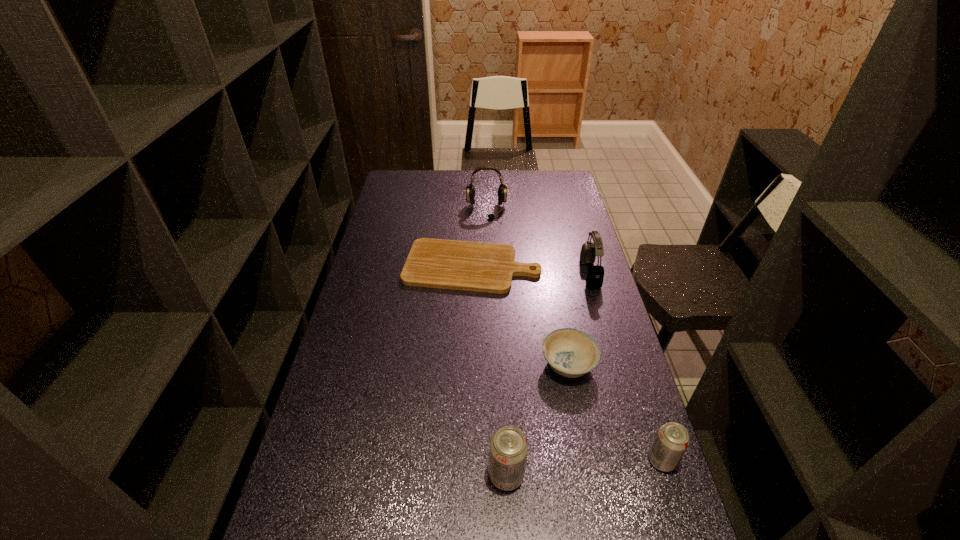
Identify the location of vacant space located on the back of the fourth tallest object. The width and height of the screenshot is (960, 540). (641, 397).

This screenshot has height=540, width=960. I want to click on blank area located 0.360m on the back of the shortest object, so click(x=473, y=197).

Locate an element on the screen. free space located 0.200m with the microphone on the side of the farther headset is located at coordinates (488, 247).

The height and width of the screenshot is (540, 960). I want to click on free location located on the headband of the right headset, so click(553, 274).

This screenshot has height=540, width=960. I want to click on vacant space located 0.370m on the headband of the right headset, so click(484, 274).

The image size is (960, 540). Identify the location of blank space located 0.170m on the headband of the right headset. (537, 274).

Find the location of a particular element. This screenshot has height=540, width=960. vacant space situated on the back of the fourth farthest object is located at coordinates (551, 273).

This screenshot has width=960, height=540. Find the location of `object that is at the left edge`. object that is at the left edge is located at coordinates (483, 267).

Locate an element on the screen. The width and height of the screenshot is (960, 540). soda can that is positioned at the right edge is located at coordinates (672, 440).

Identify the location of headset that is positioned at the right edge. (595, 275).